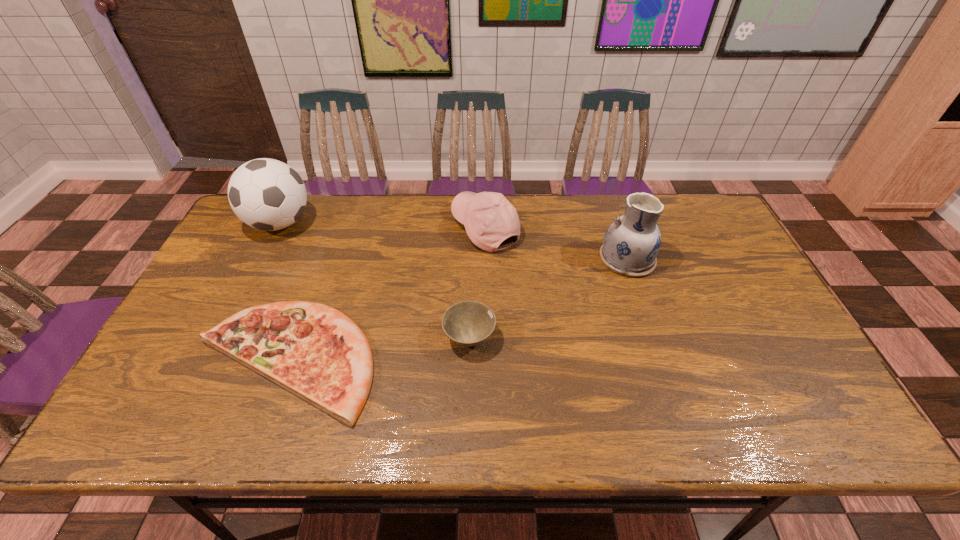
Locate an element on the screen. The width and height of the screenshot is (960, 540). free point at the near edge is located at coordinates (375, 434).

The width and height of the screenshot is (960, 540). I want to click on free space at the left edge of the desktop, so click(x=252, y=280).

Locate an element on the screen. The width and height of the screenshot is (960, 540). vacant space at the right edge is located at coordinates (766, 309).

Locate an element on the screen. This screenshot has height=540, width=960. vacant space at the far right corner of the desktop is located at coordinates (689, 235).

The width and height of the screenshot is (960, 540). Identify the location of vacant region between the fourth tallest object and the pizza. (377, 349).

You are a GUI agent. You are given a task and a screenshot of the screen. Output one action in this format:
    pyautogui.click(x=<x>, y=<y>)
    Task: Click on the free space between the third shortest object and the second shortest object
    The height and width of the screenshot is (540, 960).
    Given the screenshot: What is the action you would take?
    pyautogui.click(x=477, y=283)

The image size is (960, 540). In order to click on vacant space in between the pottery and the soccer ball in this screenshot , I will do `click(453, 241)`.

Where is `free spot between the third tallest object and the pottery`? The width and height of the screenshot is (960, 540). free spot between the third tallest object and the pottery is located at coordinates (556, 244).

Where is `unoccupied area between the shortest object and the bowl`? unoccupied area between the shortest object and the bowl is located at coordinates (377, 349).

Where is `free space between the soccer ball and the pottery`? The height and width of the screenshot is (540, 960). free space between the soccer ball and the pottery is located at coordinates (453, 241).